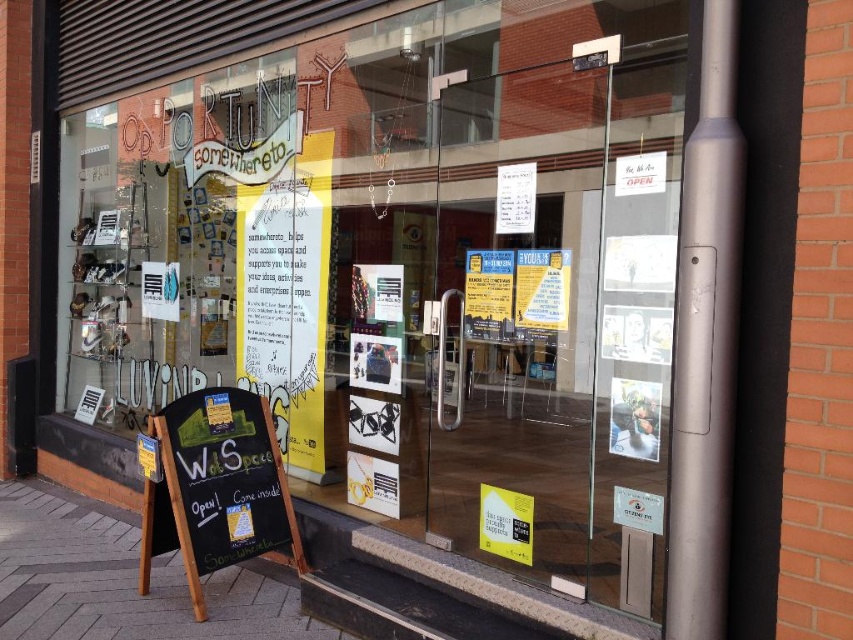
Question: Which of the following is the farthest from the observer?

Choices:
 (A) black chalkboard at lower left
 (B) transparent glass shop window at center

Answer: (A)

Question: Can you confirm if transparent glass shop window at center is positioned above black chalkboard at lower left?

Choices:
 (A) no
 (B) yes

Answer: (B)

Question: Can you confirm if transparent glass shop window at center is bigger than black chalkboard at lower left?

Choices:
 (A) yes
 (B) no

Answer: (A)

Question: Which point is closer to the camera?

Choices:
 (A) transparent glass shop window at center
 (B) black chalkboard at lower left

Answer: (A)

Question: Is transparent glass shop window at center below black chalkboard at lower left?

Choices:
 (A) yes
 (B) no

Answer: (B)

Question: Which object appears farthest from the camera in this image?

Choices:
 (A) transparent glass shop window at center
 (B) black chalkboard at lower left

Answer: (B)